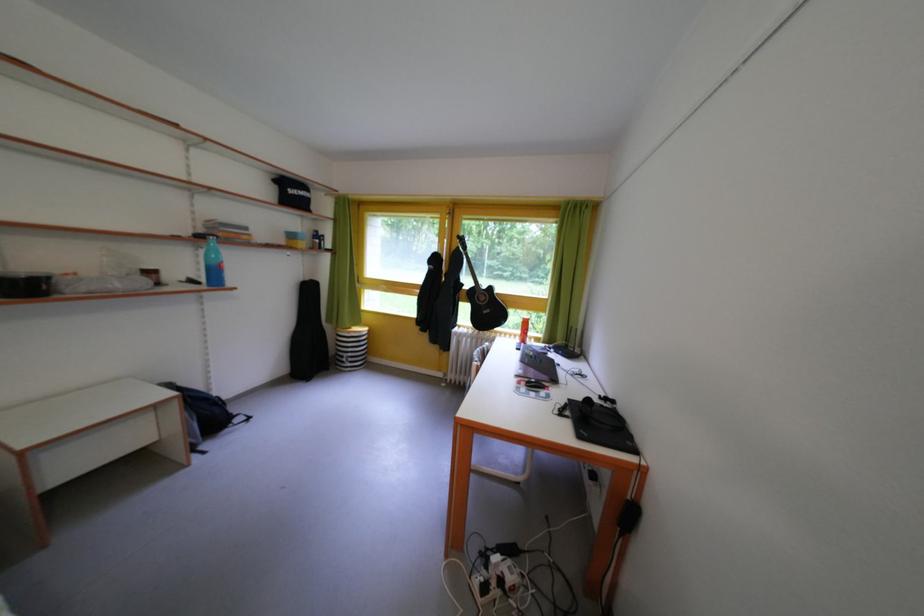
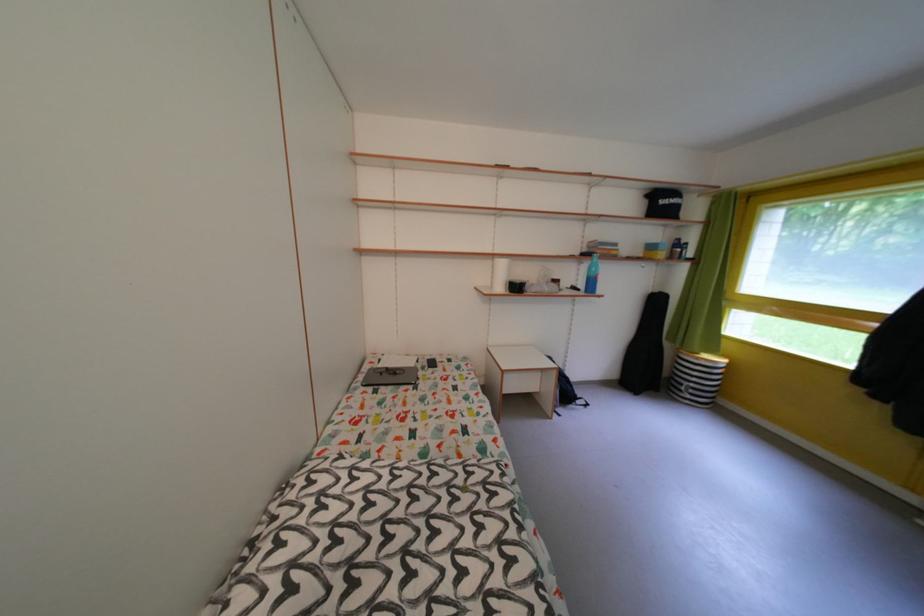
Find the pixel in the second image that matches pixel 186 414 in the first image.

(563, 382)